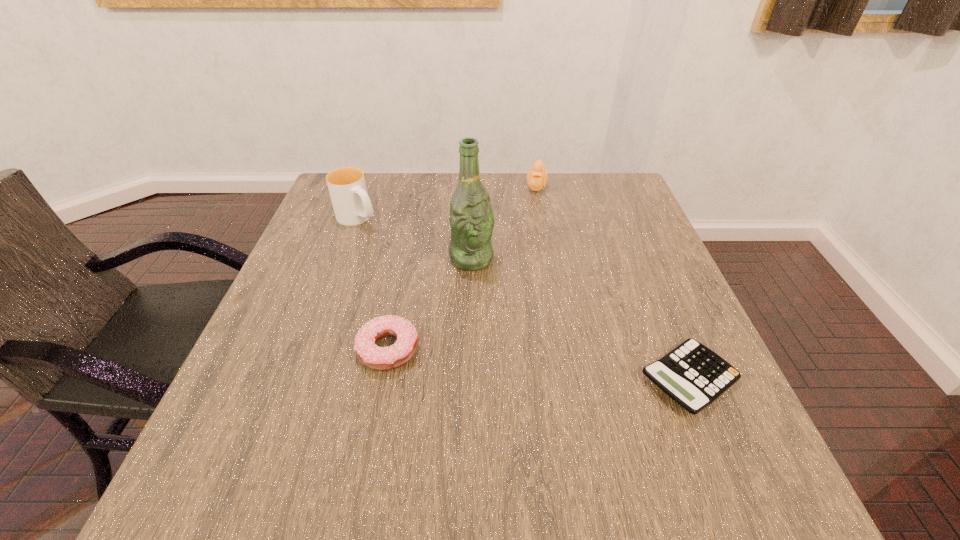
At what (x,y) coordinates should I click in order to perform the action: click on free region located 0.340m on the surface of the third object from right to left. Please return your answer as a coordinate pair (x, y). The image size is (960, 540). Looking at the image, I should click on (581, 374).

This screenshot has width=960, height=540. I want to click on duckling positioned at the far edge, so click(537, 177).

Identify the location of cup located at the far edge. The height and width of the screenshot is (540, 960). (352, 206).

Locate an element on the screen. This screenshot has width=960, height=540. object located in the near edge section of the desktop is located at coordinates (694, 376).

Locate an element on the screen. object at the left edge is located at coordinates (352, 206).

The height and width of the screenshot is (540, 960). Identify the location of object at the right edge. (694, 376).

Locate an element on the screen. This screenshot has height=540, width=960. object that is at the far left corner is located at coordinates (352, 206).

At what (x,y) coordinates should I click in order to perform the action: click on object that is at the near right corner. Please return your answer as a coordinate pair (x, y). Looking at the image, I should click on (694, 376).

Find the location of `vacant region at the far edge of the desktop`. vacant region at the far edge of the desktop is located at coordinates (558, 175).

Where is `free space at the left edge of the desktop`? This screenshot has height=540, width=960. free space at the left edge of the desktop is located at coordinates (329, 325).